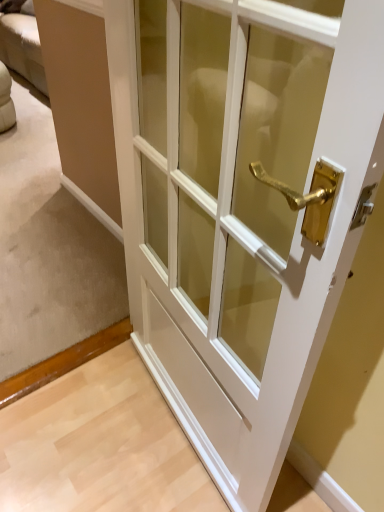
Locate an element on the screen. The width and height of the screenshot is (384, 512). white wood door at center is located at coordinates (242, 207).

In the scene shown: In order to face white wood door at center, should I rotate leftwards or rightwards?

To face it directly, rotate left by 1.466 degrees.

What do you see at coordinates (242, 207) in the screenshot?
I see `white wood door at center` at bounding box center [242, 207].

Where is `white wood door at center`? white wood door at center is located at coordinates (242, 207).